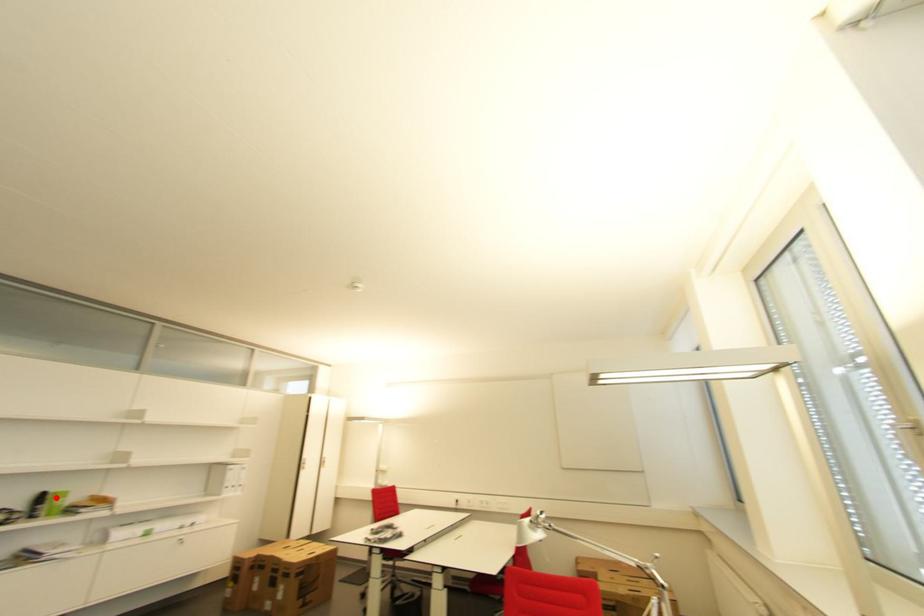
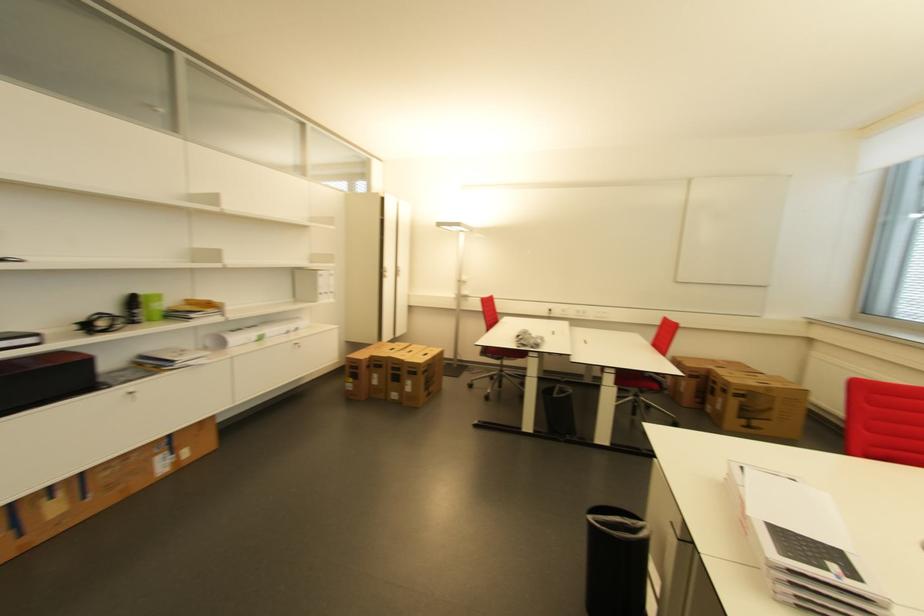
Where in the second image is the point corresponding to the highlighted location from the first image?

(147, 301)